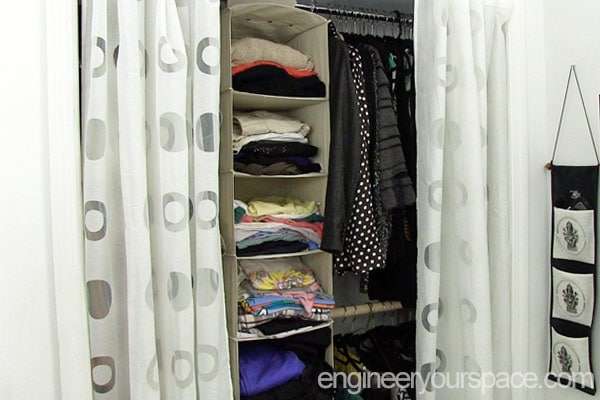
Find the location of a particular element. This screenshot has height=400, width=600. closet is located at coordinates (363, 188).